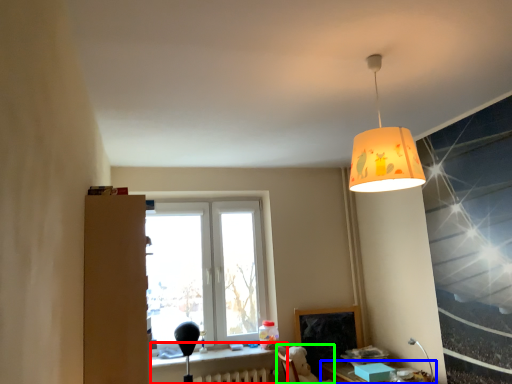
Question: Which object is positioned farthest from table (highlighted by a red box)? Select from table (highlighted by a blue box) and swivel chair (highlighted by a green box).

Choices:
 (A) table
 (B) swivel chair

Answer: (A)